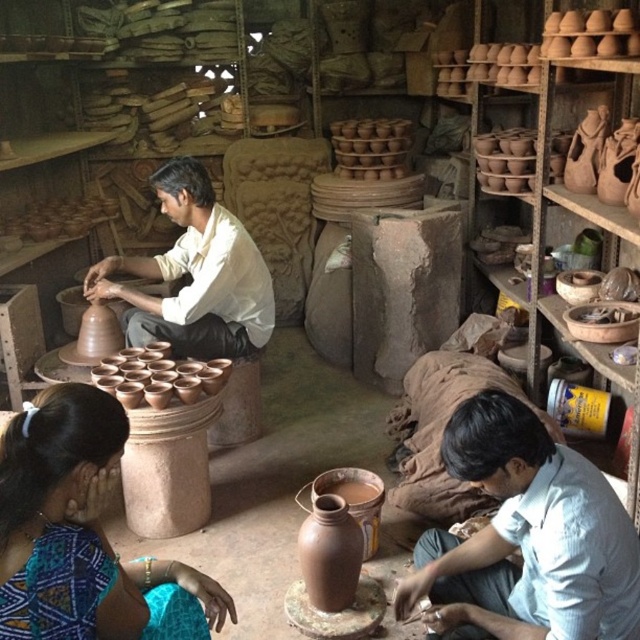
Question: Is blue printed fabric at lower left positioned behind matte clay cups at center?

Choices:
 (A) no
 (B) yes

Answer: (A)

Question: Among these objects, which one is nearest to the camera?

Choices:
 (A) matte clay vase at center
 (B) light blue cotton shirt at lower right
 (C) matte clay cups at center

Answer: (B)

Question: Does light blue cotton shirt at lower right have a larger size compared to matte clay potter at center?

Choices:
 (A) yes
 (B) no

Answer: (B)

Question: Considering the real-world distances, which object is farthest from the matte clay cups at center?

Choices:
 (A) matte clay vase at center
 (B) matte clay potter at center

Answer: (A)

Question: Which of the following is the farthest from the observer?

Choices:
 (A) matte clay potter at center
 (B) matte clay vase at center
 (C) blue printed fabric at lower left
 (D) light blue cotton shirt at lower right

Answer: (A)

Question: Observing the image, what is the correct spatial positioning of light blue cotton shirt at lower right in reference to matte clay potter at center?

Choices:
 (A) above
 (B) below

Answer: (B)